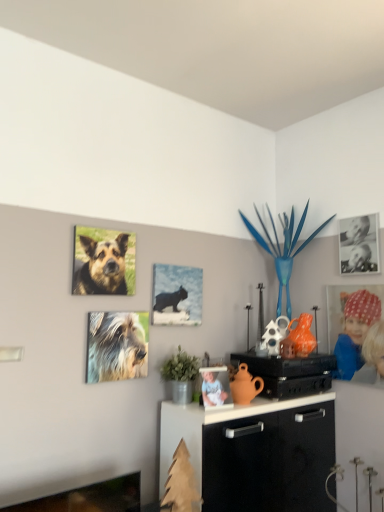
Question: From a real-world perspective, is white porcelain figurine at center, marked as the 2th person in a right-to-left arrangement, beneath black paper photo at upper right, which ranks as the second picture frame in bottom-to-top order?

Choices:
 (A) yes
 (B) no

Answer: (A)

Question: Can you see white porcelain figurine at center, the first person from the left, touching black paper photo at upper right, marked as the second picture frame in a left-to-right arrangement?

Choices:
 (A) no
 (B) yes

Answer: (A)

Question: Is white porcelain figurine at center, marked as the 2th person in a right-to-left arrangement, positioned before black paper photo at upper right, which is the first picture frame from right to left?

Choices:
 (A) no
 (B) yes

Answer: (B)

Question: Is white porcelain figurine at center, the 1th person in the front-to-back sequence, shorter than black paper photo at upper right, which ranks as the second picture frame in bottom-to-top order?

Choices:
 (A) yes
 (B) no

Answer: (A)

Question: Can black paper photo at upper right, which is the first picture frame from right to left, be found inside white porcelain figurine at center, the second person in the back-to-front sequence?

Choices:
 (A) yes
 (B) no

Answer: (B)

Question: Relative to metallic blue plant at upper center, is fuzzy fur dog at upper left, the 1th dog positioned from the bottom, in front or behind?

Choices:
 (A) behind
 (B) front

Answer: (B)

Question: Based on their sizes in the image, would you say fuzzy fur dog at upper left, the 1th dog positioned from the bottom, is bigger or smaller than metallic blue plant at upper center?

Choices:
 (A) big
 (B) small

Answer: (B)

Question: Would you say fuzzy fur dog at upper left, the 2th dog positioned from the top, is to the left or to the right of metallic blue plant at upper center in the picture?

Choices:
 (A) right
 (B) left

Answer: (B)

Question: Is point (134, 352) positioned closer to the camera than point (296, 227)?

Choices:
 (A) farther
 (B) closer

Answer: (B)

Question: Considering the positions of point (364, 262) and point (155, 287), is point (364, 262) closer or farther from the camera than point (155, 287)?

Choices:
 (A) closer
 (B) farther

Answer: (B)

Question: In terms of width, does black paper photo at upper right, marked as the first picture frame in a top-to-bottom arrangement, look wider or thinner when compared to matte black cat at center, positioned as the first picture frame in left-to-right order?

Choices:
 (A) thin
 (B) wide

Answer: (A)

Question: Considering the positions of black paper photo at upper right, which is the first picture frame from right to left, and matte black cat at center, positioned as the first picture frame in left-to-right order, in the image, is black paper photo at upper right, which is the first picture frame from right to left, bigger or smaller than matte black cat at center, positioned as the first picture frame in left-to-right order,?

Choices:
 (A) small
 (B) big

Answer: (A)

Question: In terms of height, does black paper photo at upper right, marked as the first picture frame in a top-to-bottom arrangement, look taller or shorter compared to matte black cat at center, which appears as the second picture frame when viewed from the top?

Choices:
 (A) short
 (B) tall

Answer: (B)

Question: Visually, is metallic blue plant at upper center positioned to the left or to the right of fuzzy fur dog at upper left, the 2th dog positioned from the top?

Choices:
 (A) right
 (B) left

Answer: (A)

Question: In the image, is metallic blue plant at upper center positioned in front of or behind fuzzy fur dog at upper left, the 1th dog positioned from the bottom?

Choices:
 (A) front
 (B) behind

Answer: (B)